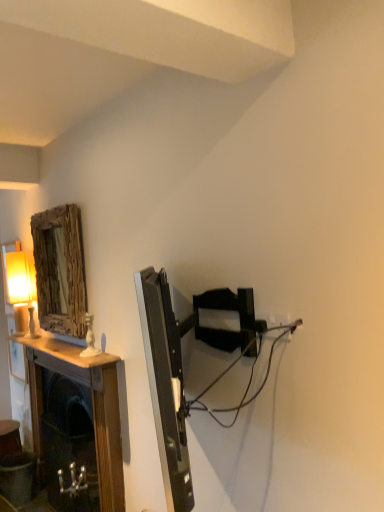
Question: Does wooden textured mirror at upper left come in front of wooden mantel at left?

Choices:
 (A) no
 (B) yes

Answer: (A)

Question: Is wooden textured mirror at upper left bigger than wooden mantel at left?

Choices:
 (A) no
 (B) yes

Answer: (A)

Question: From a real-world perspective, does wooden textured mirror at upper left sit lower than wooden mantel at left?

Choices:
 (A) yes
 (B) no

Answer: (B)

Question: Does wooden textured mirror at upper left have a smaller size compared to wooden mantel at left?

Choices:
 (A) yes
 (B) no

Answer: (A)

Question: Can you confirm if wooden textured mirror at upper left is positioned to the right of wooden mantel at left?

Choices:
 (A) yes
 (B) no

Answer: (B)

Question: Is wooden textured mirror at upper left facing towards wooden mantel at left?

Choices:
 (A) yes
 (B) no

Answer: (B)

Question: Does wooden textured mirror at upper left come behind black plastic cable at center right?

Choices:
 (A) no
 (B) yes

Answer: (B)

Question: Is wooden textured mirror at upper left at the right side of black plastic cable at center right?

Choices:
 (A) no
 (B) yes

Answer: (A)

Question: Is wooden textured mirror at upper left closer to camera compared to black plastic cable at center right?

Choices:
 (A) no
 (B) yes

Answer: (A)

Question: From a real-world perspective, is wooden textured mirror at upper left positioned under black plastic cable at center right based on gravity?

Choices:
 (A) yes
 (B) no

Answer: (B)

Question: Is wooden textured mirror at upper left next to black plastic cable at center right?

Choices:
 (A) no
 (B) yes

Answer: (A)

Question: Is wooden textured mirror at upper left thinner than black plastic cable at center right?

Choices:
 (A) no
 (B) yes

Answer: (B)

Question: Is wooden mantel at left positioned behind matte cream table lamp at left?

Choices:
 (A) yes
 (B) no

Answer: (B)